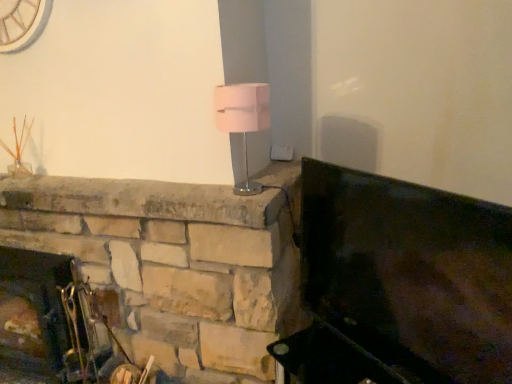
What is the approximate width of metallic silver fireplace tools at lower left?

The width of metallic silver fireplace tools at lower left is 11.72 inches.

I want to click on metallic silver fireplace tools at lower left, so click(x=32, y=316).

Can you confirm if metallic silver fireplace tools at lower left is smaller than metallic dark green fireplace at right?

Incorrect, metallic silver fireplace tools at lower left is not smaller in size than metallic dark green fireplace at right.

Considering the positions of points (38, 289) and (447, 253), is point (38, 289) farther from camera compared to point (447, 253)?

Yes.

From the picture: Is metallic silver fireplace tools at lower left oriented away from metallic dark green fireplace at right?

metallic silver fireplace tools at lower left does not have its back to metallic dark green fireplace at right.

Locate an element on the screen. fireplace that appears behind the metallic dark green fireplace at right is located at coordinates [32, 316].

Based on the photo, in terms of width, does metallic silver fireplace tools at lower left look wider or thinner when compared to pink fabric lampshade at center?

Considering their sizes, metallic silver fireplace tools at lower left looks broader than pink fabric lampshade at center.

Who is shorter, metallic silver fireplace tools at lower left or pink fabric lampshade at center?

Standing shorter between the two is pink fabric lampshade at center.

Is metallic silver fireplace tools at lower left facing away from pink fabric lampshade at center?

No, metallic silver fireplace tools at lower left is not facing the opposite direction of pink fabric lampshade at center.

From a real-world perspective, is metallic silver fireplace tools at lower left positioned over pink fabric lampshade at center based on gravity?

No, from a real-world perspective, metallic silver fireplace tools at lower left is not on top of pink fabric lampshade at center.

Which point is more forward, (x=445, y=351) or (x=25, y=335)?

The point (x=445, y=351) is closer to the camera.

Where is `furniture above the metallic silver fireplace tools at lower left (from a real-world perspective)`? furniture above the metallic silver fireplace tools at lower left (from a real-world perspective) is located at coordinates (399, 284).

Would you say metallic dark green fireplace at right is to the left or to the right of metallic silver fireplace tools at lower left in the picture?

Clearly, metallic dark green fireplace at right is on the right of metallic silver fireplace tools at lower left in the image.

Considering the sizes of objects metallic dark green fireplace at right and metallic silver fireplace tools at lower left in the image provided, who is smaller, metallic dark green fireplace at right or metallic silver fireplace tools at lower left?

With smaller size is metallic dark green fireplace at right.

Is pink fabric lampshade at center far away from metallic silver fireplace tools at lower left?

Indeed, pink fabric lampshade at center is not near metallic silver fireplace tools at lower left.

Considering the points (232, 124) and (62, 373), which point is in front, point (232, 124) or point (62, 373)?

The point (232, 124) is closer.

Is pink fabric lampshade at center thinner than metallic silver fireplace tools at lower left?

Correct, the width of pink fabric lampshade at center is less than that of metallic silver fireplace tools at lower left.

Is the depth of pink fabric lampshade at center greater than that of metallic silver fireplace tools at lower left?

That is False.

Which object is thinner, pink fabric lampshade at center or metallic dark green fireplace at right?

Thinner between the two is metallic dark green fireplace at right.

Is pink fabric lampshade at center not within metallic dark green fireplace at right?

pink fabric lampshade at center is positioned outside metallic dark green fireplace at right.

From a real-world perspective, is pink fabric lampshade at center located beneath metallic dark green fireplace at right?

Incorrect, from a real-world perspective, pink fabric lampshade at center is higher than metallic dark green fireplace at right.

Between point (238, 184) and point (301, 288), which one is positioned in front?

The point (238, 184) is in front.

Considering the positions of objects metallic dark green fireplace at right and pink fabric lampshade at center in the image provided, who is more to the left, metallic dark green fireplace at right or pink fabric lampshade at center?

Positioned to the left is pink fabric lampshade at center.

Is metallic dark green fireplace at right not inside pink fabric lampshade at center?

Absolutely, metallic dark green fireplace at right is external to pink fabric lampshade at center.

Is the position of metallic dark green fireplace at right less distant than that of pink fabric lampshade at center?

Yes, it is in front of pink fabric lampshade at center.

Where is `fireplace behind the metallic dark green fireplace at right`? The image size is (512, 384). fireplace behind the metallic dark green fireplace at right is located at coordinates (32, 316).

You are a GUI agent. You are given a task and a screenshot of the screen. Output one action in this format:
    pyautogui.click(x=<x>, y=<y>)
    Task: Click on the fireplace to the left of pink fabric lampshade at center
    The height and width of the screenshot is (384, 512).
    Given the screenshot: What is the action you would take?
    coord(32,316)

When comparing their distances from pink fabric lampshade at center, does metallic dark green fireplace at right or metallic silver fireplace tools at lower left seem closer?

metallic dark green fireplace at right.

Based on their spatial positions, is pink fabric lampshade at center or metallic dark green fireplace at right closer to metallic silver fireplace tools at lower left?

Among the two, metallic dark green fireplace at right is located nearer to metallic silver fireplace tools at lower left.

From the image, which object appears to be nearer to pink fabric lampshade at center, metallic silver fireplace tools at lower left or metallic dark green fireplace at right?

metallic dark green fireplace at right lies closer to pink fabric lampshade at center than the other object.

Based on the photo, based on their spatial positions, is pink fabric lampshade at center or metallic silver fireplace tools at lower left closer to metallic dark green fireplace at right?

pink fabric lampshade at center is closer to metallic dark green fireplace at right.

From the image, which object appears to be farther from metallic dark green fireplace at right, metallic silver fireplace tools at lower left or pink fabric lampshade at center?

metallic silver fireplace tools at lower left is further to metallic dark green fireplace at right.

Considering their positions, is metallic dark green fireplace at right positioned further to metallic silver fireplace tools at lower left than pink fabric lampshade at center?

pink fabric lampshade at center lies further to metallic silver fireplace tools at lower left than the other object.

I want to click on table lamp between metallic silver fireplace tools at lower left and metallic dark green fireplace at right in the horizontal direction, so [x=243, y=120].